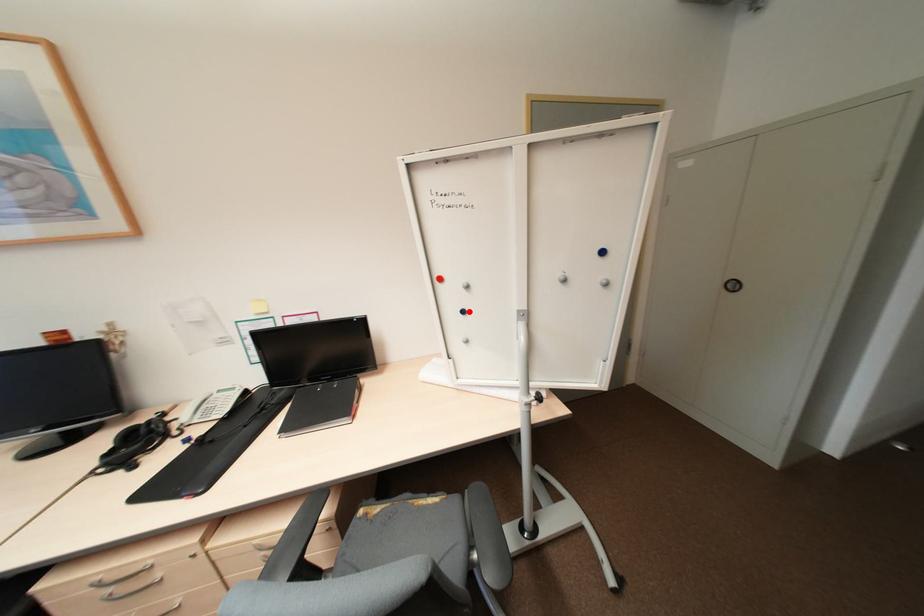
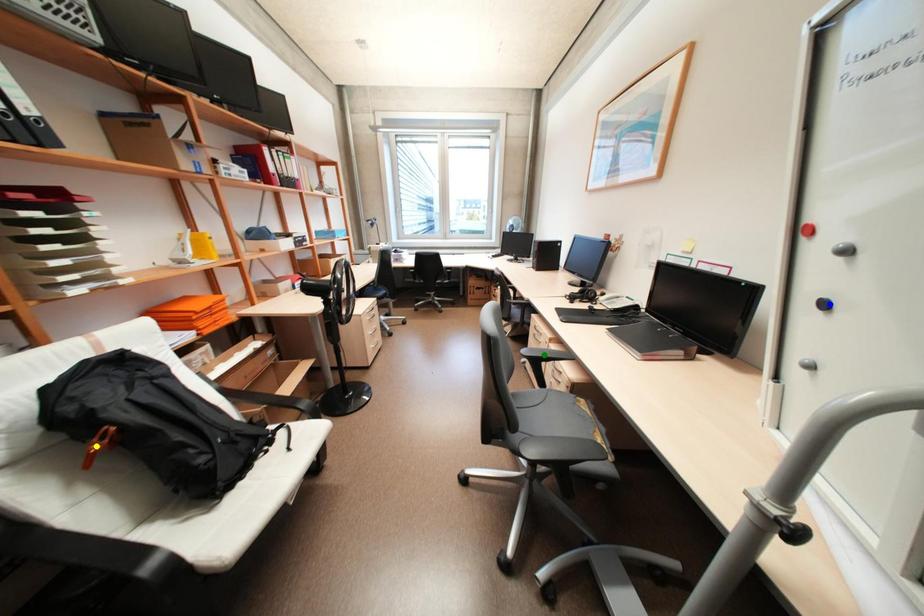
Question: I am providing you with two images of the same scene from different viewpoints. A red point is marked on the first image. You are given multiple points on the second image. Which spot in image 2 lines up with the point in image 1?

Choices:
 (A) green point
 (B) yellow point
 (C) blue point

Answer: (C)